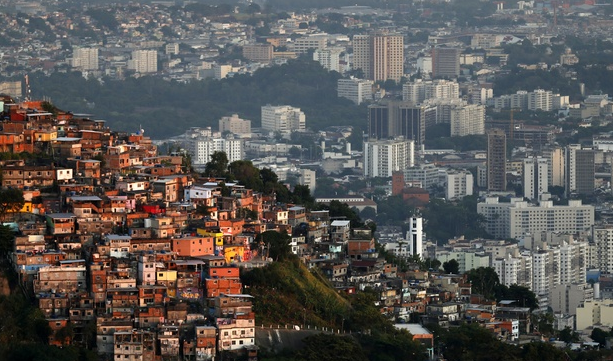
Where is `wall`? This screenshot has height=361, width=613. wall is located at coordinates click(x=280, y=326), click(x=321, y=326), click(x=339, y=333).